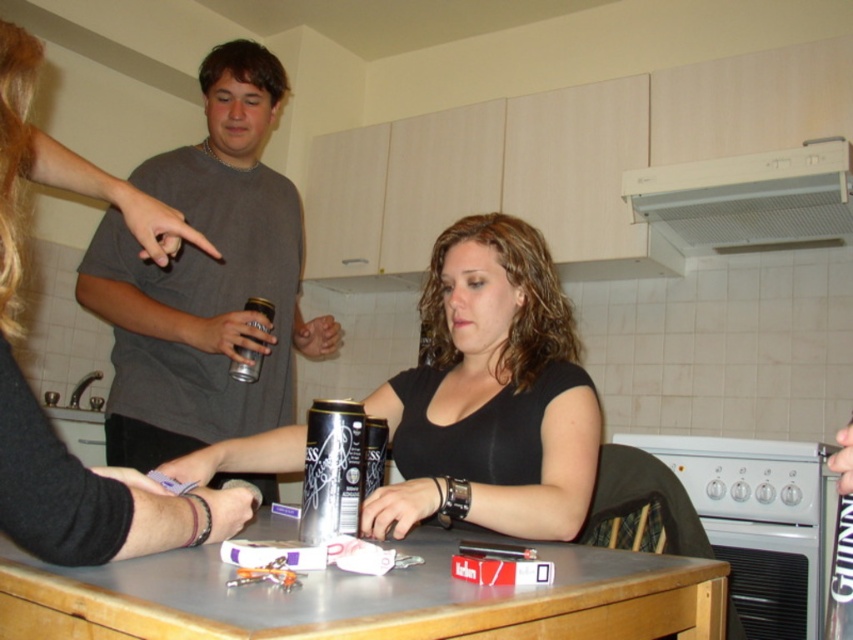
Between matte black shirt at center and silver metallic can at center, which one is positioned higher?

matte black shirt at center is above.

Does matte black shirt at center have a greater width compared to silver metallic can at center?

Correct, the width of matte black shirt at center exceeds that of silver metallic can at center.

Is point (442, 417) positioned in front of point (352, 520)?

That is False.

Find the location of a particular element. matte black shirt at center is located at coordinates (491, 396).

Can you confirm if metallic gray table at center is positioned below metallic can at center?

Indeed, metallic gray table at center is positioned under metallic can at center.

Is metallic gray table at center to the left of metallic can at center from the viewer's perspective?

No, metallic gray table at center is not to the left of metallic can at center.

Is point (247, 536) closer to camera compared to point (252, 380)?

Yes, it is in front of point (252, 380).

Where is `metallic gray table at center`? metallic gray table at center is located at coordinates (x=364, y=598).

Can you confirm if metallic gray table at center is wider than silver metallic can at center?

Yes, metallic gray table at center is wider than silver metallic can at center.

Describe the element at coordinates (364, 598) in the screenshot. I see `metallic gray table at center` at that location.

Image resolution: width=853 pixels, height=640 pixels. In order to click on metallic gray table at center in this screenshot , I will do `click(364, 598)`.